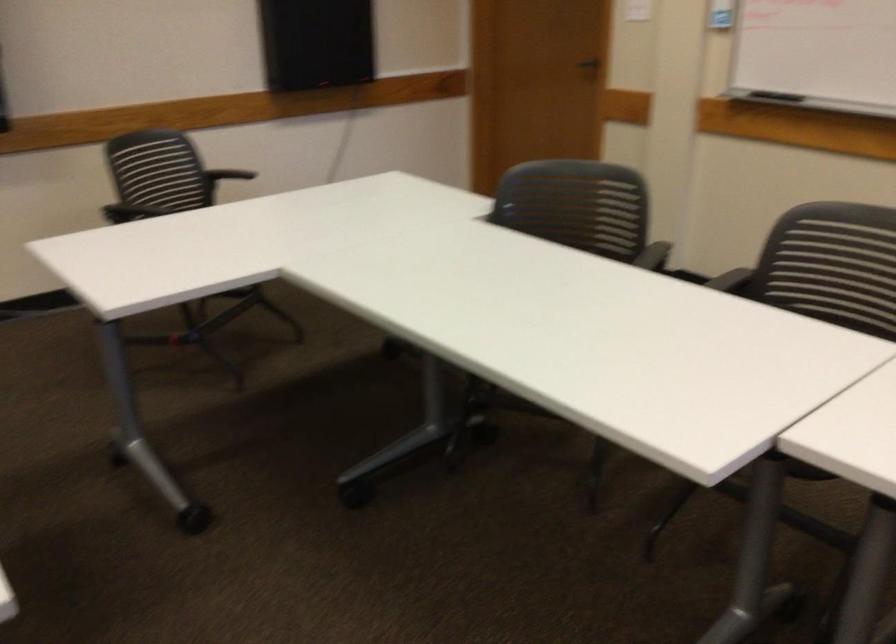
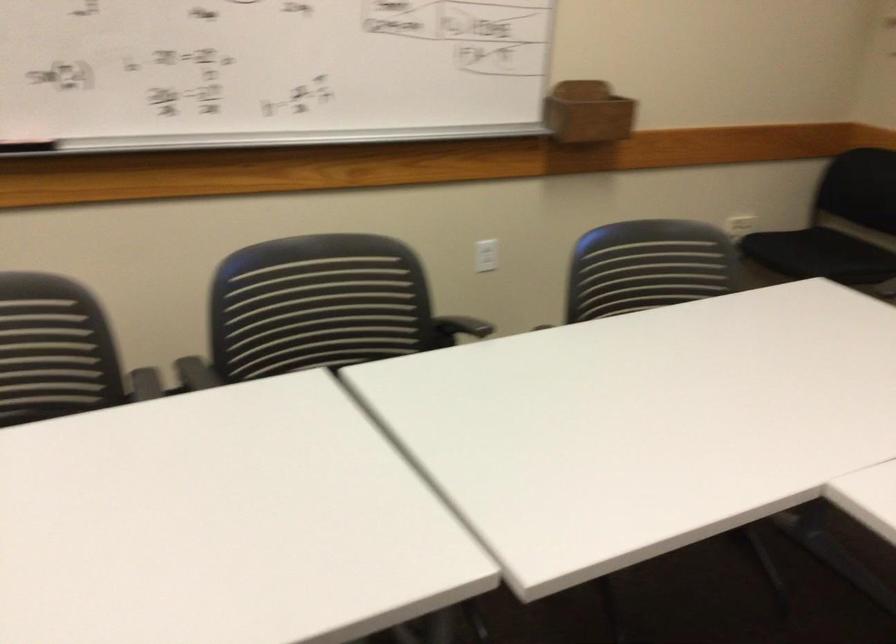
Question: The camera is either moving clockwise (left) or counter-clockwise (right) around the object. The first image is from the beginning of the video and the second image is from the end. Is the camera moving left or right when shooting the video?

Choices:
 (A) Left
 (B) Right

Answer: (A)